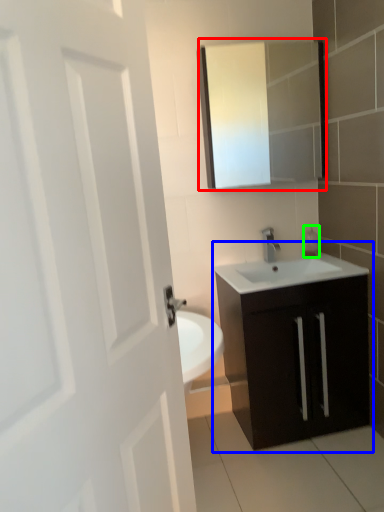
Question: Which object is positioned closest to medicine cabinet (highlighted by a red box)? Select from bathroom cabinet (highlighted by a blue box) and soap dispenser (highlighted by a green box).

Choices:
 (A) bathroom cabinet
 (B) soap dispenser

Answer: (B)